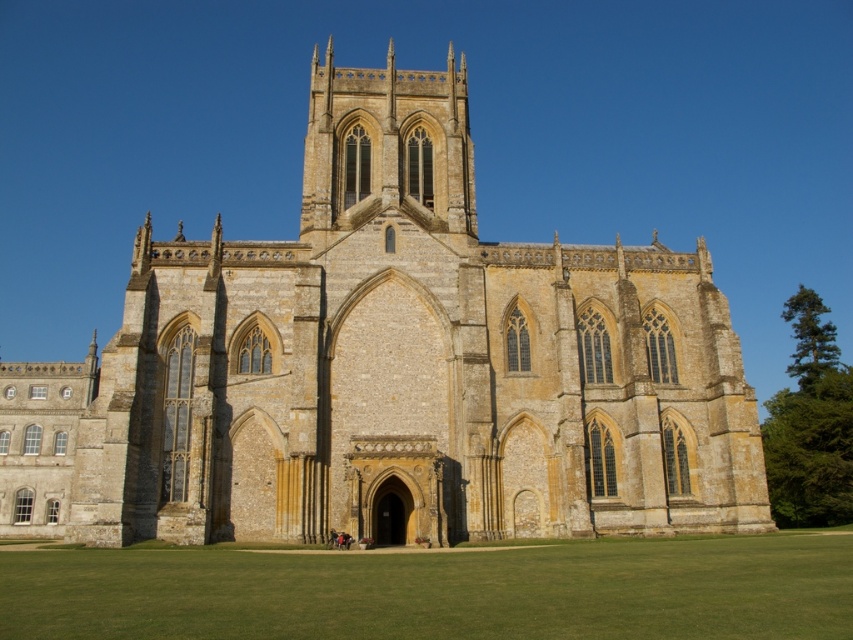
Question: Which point appears farthest from the camera in this image?

Choices:
 (A) coord(399,109)
 (B) coord(125,563)

Answer: (A)

Question: Can you confirm if yellow stone church at center is wider than green grass at center?

Choices:
 (A) yes
 (B) no

Answer: (A)

Question: Can you confirm if yellow stone church at center is positioned above green grass at center?

Choices:
 (A) yes
 (B) no

Answer: (A)

Question: From the image, what is the correct spatial relationship of yellow stone church at center in relation to green grass at center?

Choices:
 (A) below
 (B) above

Answer: (B)